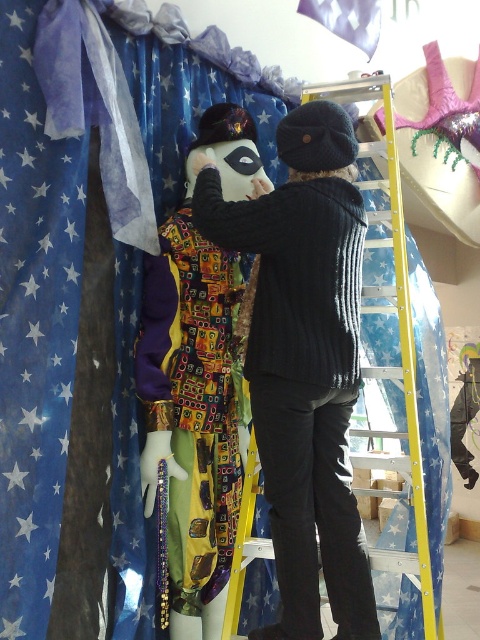
Question: Which of the following is the closest to the observer?

Choices:
 (A) blue star-patterned fabric at upper left
 (B) black knitted sweater at center
 (C) matte black mask at center
 (D) white satin flag at upper center

Answer: (A)

Question: Estimate the real-world distances between objects in this image. Which object is farther from the matte black mask at center?

Choices:
 (A) white satin flag at upper center
 (B) blue star-patterned fabric at upper left
 (C) black knitted sweater at center

Answer: (A)

Question: Is the position of black knitted sweater at center less distant than that of white satin flag at upper center?

Choices:
 (A) yes
 (B) no

Answer: (A)

Question: Is blue star-patterned fabric at upper left closer to camera compared to black knitted sweater at center?

Choices:
 (A) yes
 (B) no

Answer: (A)

Question: Considering the relative positions of black knitted sweater at center and white satin flag at upper center in the image provided, where is black knitted sweater at center located with respect to white satin flag at upper center?

Choices:
 (A) left
 (B) right

Answer: (A)

Question: Which of the following is the closest to the observer?

Choices:
 (A) (92, 204)
 (B) (351, 353)
 (C) (347, 17)

Answer: (B)